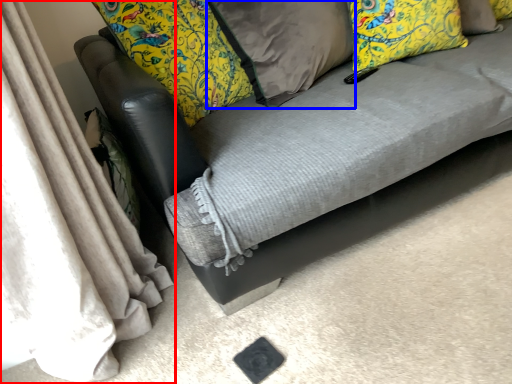
Question: Which point is further to the camera, curtain (highlighted by a red box) or pillow (highlighted by a blue box)?

Choices:
 (A) curtain
 (B) pillow

Answer: (B)